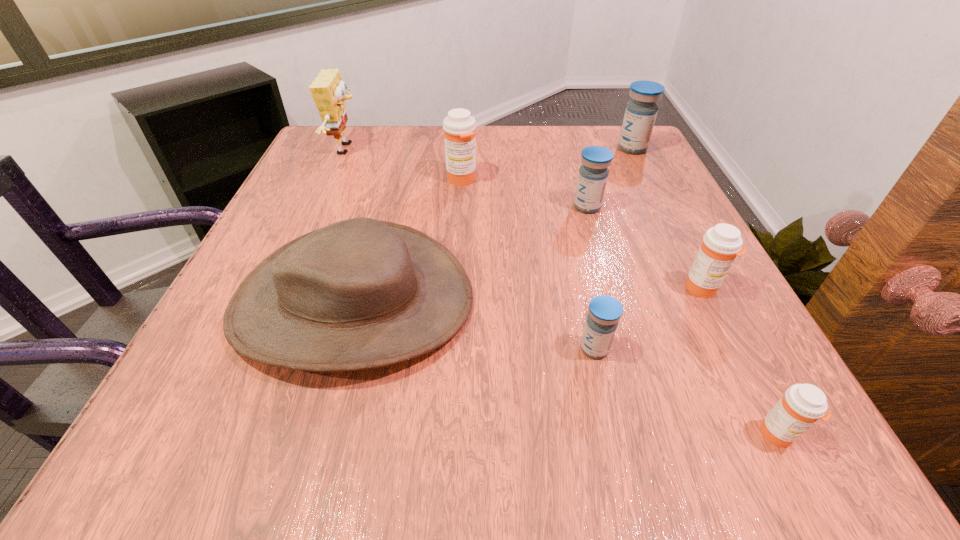
Locate an element on the screen. The width and height of the screenshot is (960, 540). vacant space that satisfies the following two spatial constraints: 1. on the front side of the smallest orange medicine; 2. on the right side of the cowboy hat is located at coordinates (315, 434).

You are a GUI agent. You are given a task and a screenshot of the screen. Output one action in this format:
    pyautogui.click(x=<x>, y=<y>)
    Task: Click on the vacant space that satisfies the following two spatial constraints: 1. on the face of the yellow sponge; 2. on the left side of the cowboy hat
    The width and height of the screenshot is (960, 540).
    Given the screenshot: What is the action you would take?
    pyautogui.click(x=280, y=301)

Where is `vacant space that satisfies the following two spatial constraints: 1. on the front side of the nearest medicine; 2. on the right side of the nearest blue medicine`? Image resolution: width=960 pixels, height=540 pixels. vacant space that satisfies the following two spatial constraints: 1. on the front side of the nearest medicine; 2. on the right side of the nearest blue medicine is located at coordinates (614, 434).